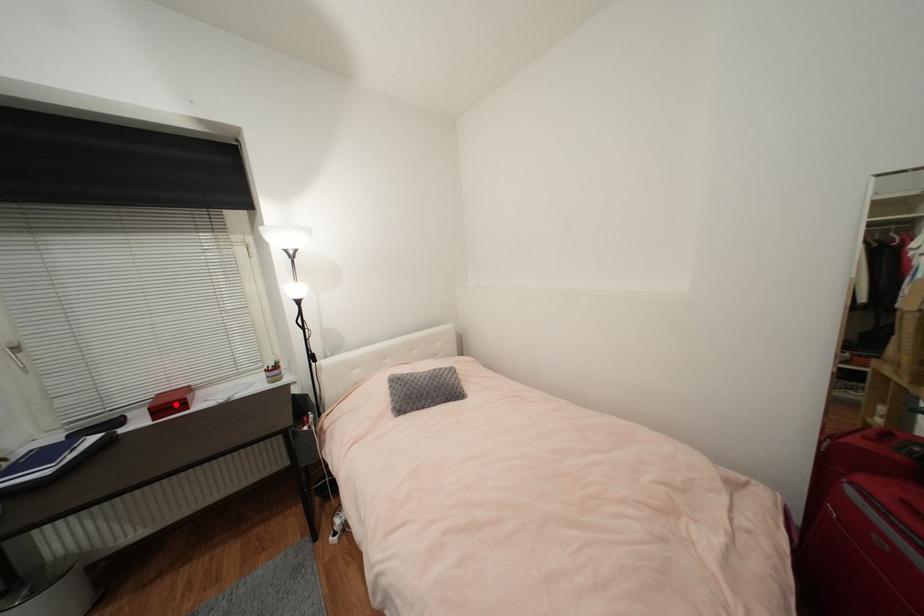
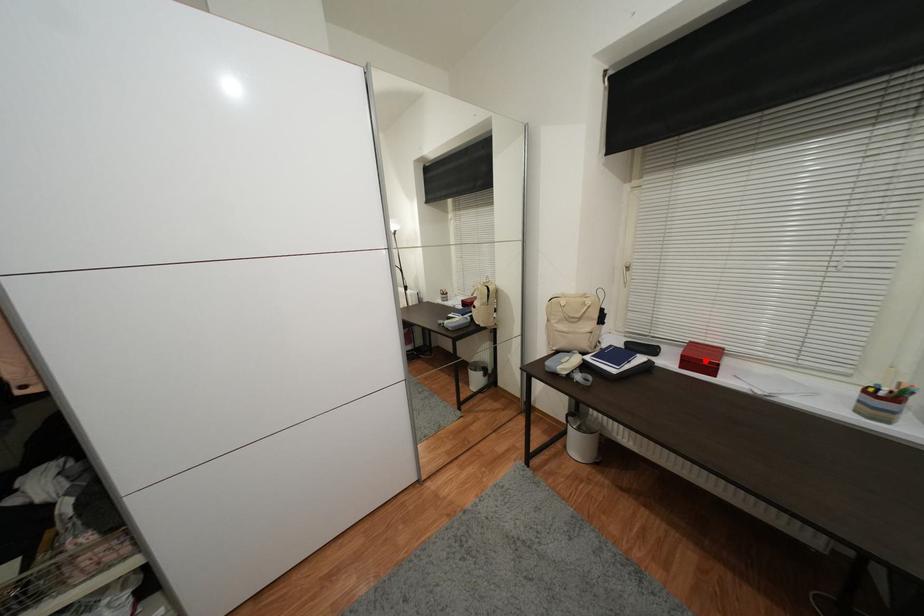
I am providing you with two images of the same scene from different viewpoints. A red point is marked on the first image and another point is marked on the second image. Does the point marked in image1 correspond to the same location as the one in image2?

Yes